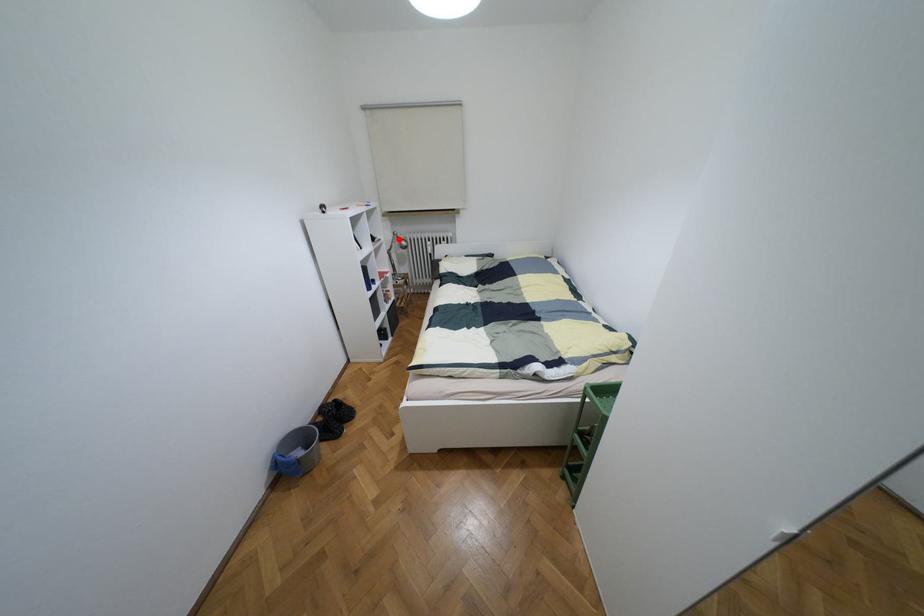
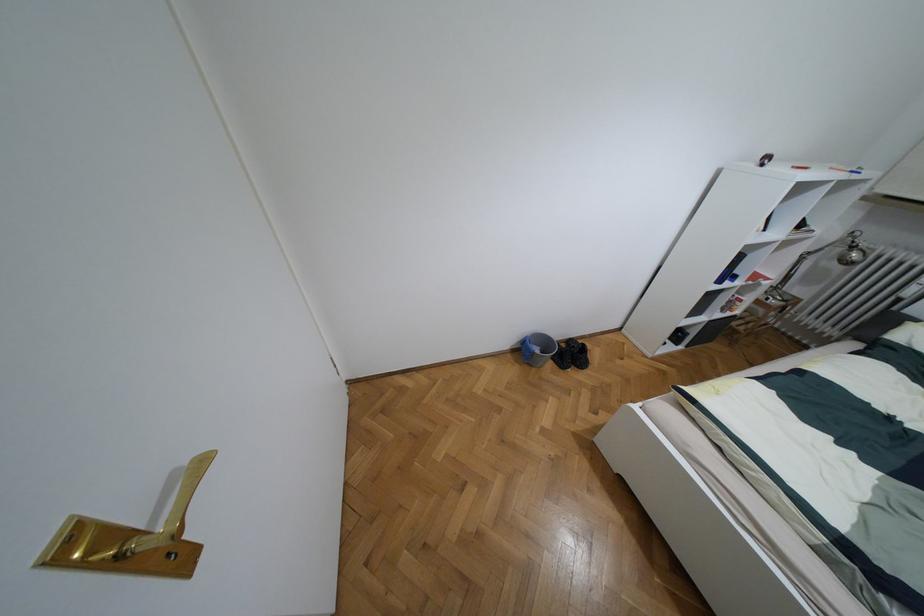
Question: I am providing you with two images of the same scene from different viewpoints. Image1 has a red point marked. In image2, the corresponding 3D location appears at what relative position? Reply with the corresponding letter.

Choices:
 (A) Closer
 (B) Farther

Answer: (B)